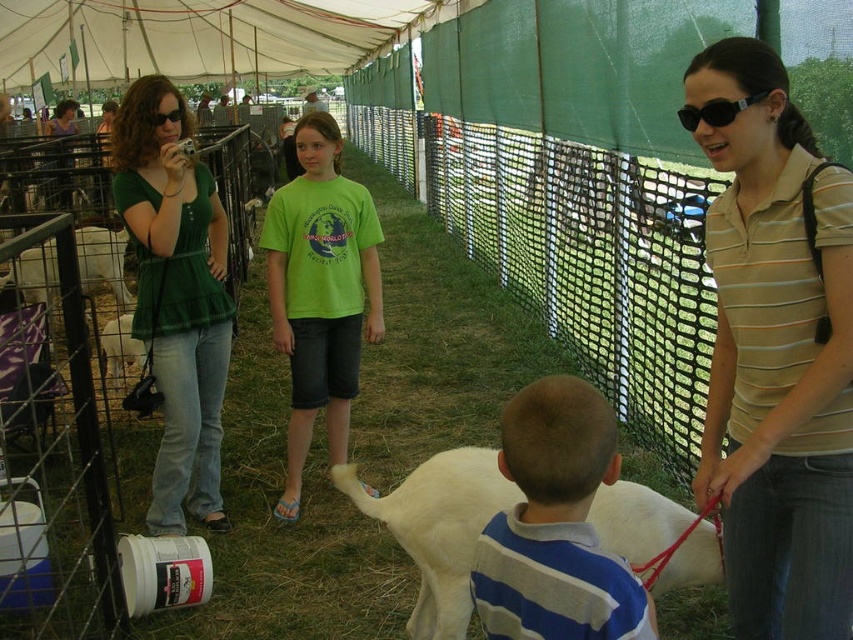
You are a visitor at the petting zoo and want to take a photo of the white woolen goat at center without any obstructions. Is the white canvas tent at upper center blocking your view of the goat?

The white canvas tent at upper center is positioned over the white woolen goat at center, so it may block your view of the goat depending on your angle and distance. To avoid obstruction, move to a position where the tent is not directly above the goat.

You are standing at the position of point (154, 124) and want to walk towards point (527, 483). Based on the scene description, will you be walking towards the lamb or away from the lamb?

Point (527, 483) is in front of point (154, 124), so walking towards point (527, 483) means you are walking towards the lamb.

You are standing at the entrance of the tent and want to take a photo of both the boy and the lamb. The boy is at point (206, 36) and the lamb is at point (337, 467). Which point is closer to you so you can focus your camera first?

Point (206, 36) is closer to you than point (337, 467), so focus on that point first.